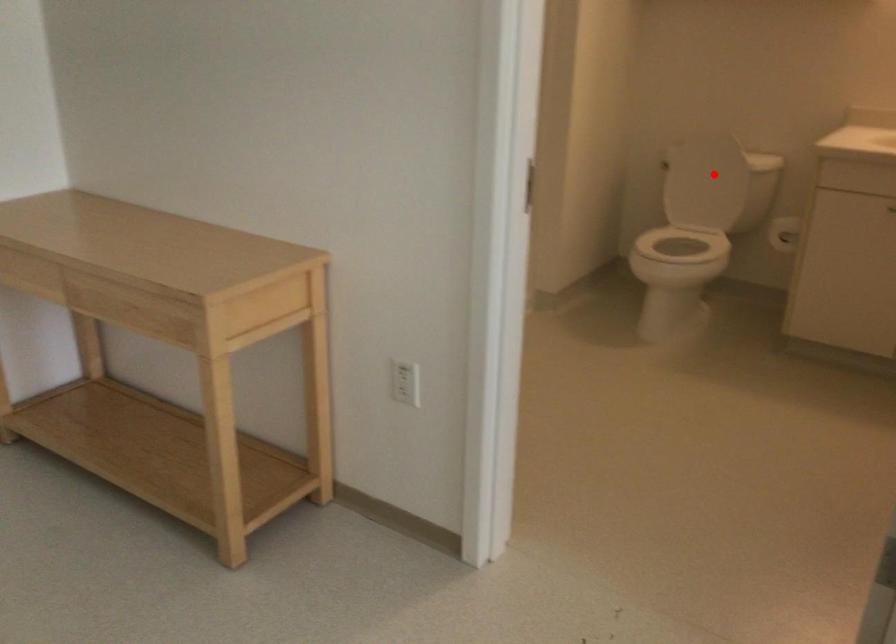
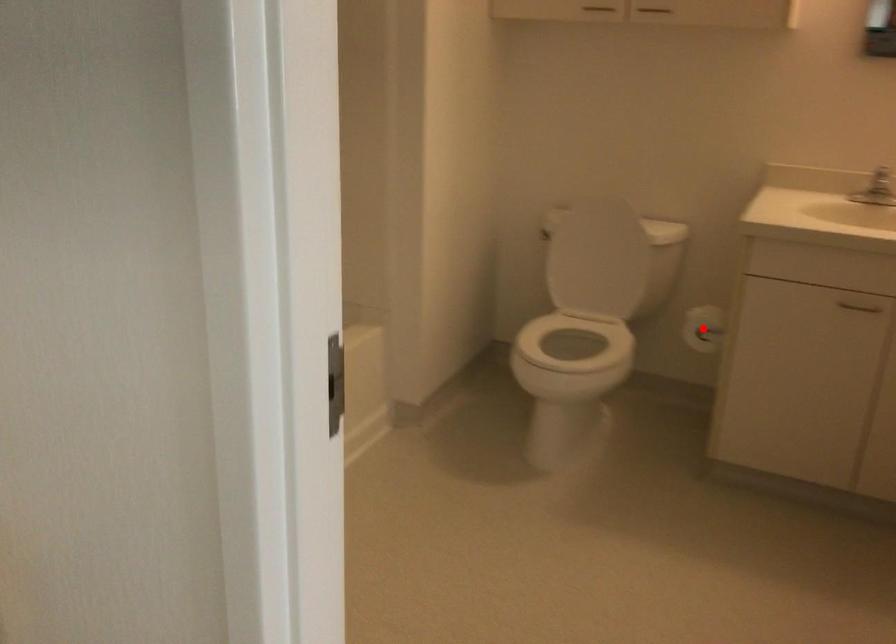
I am providing you with two images of the same scene from different viewpoints. A red point is marked on the first image and another point is marked on the second image. Is the red point in image1 aligned with the point shown in image2?

No